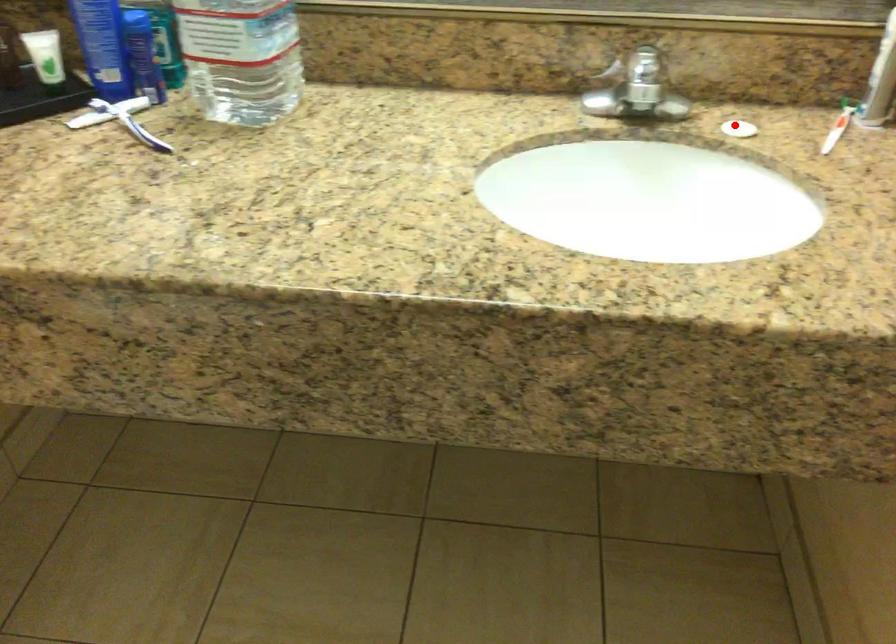
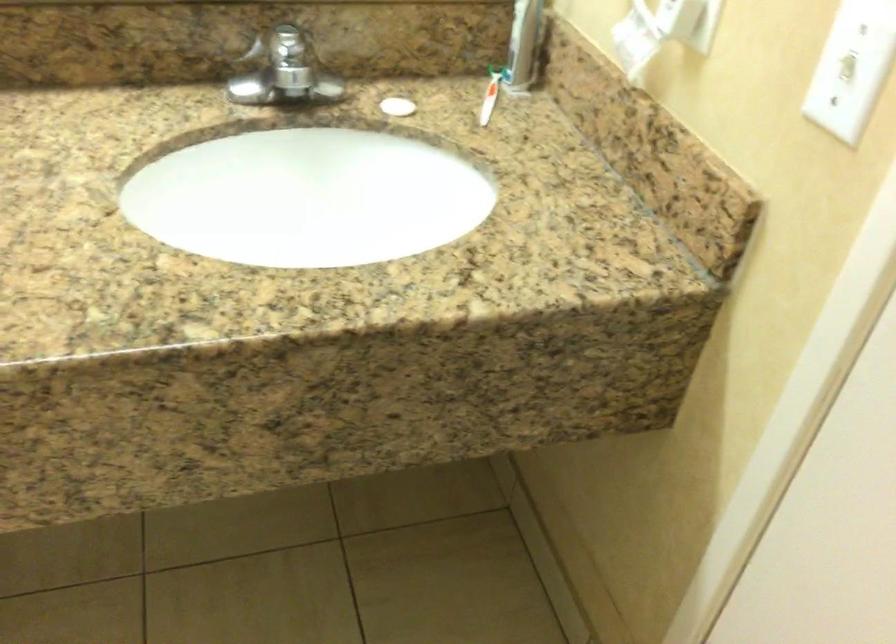
Where in the second image is the point corresponding to the highlighted location from the first image?

(398, 106)